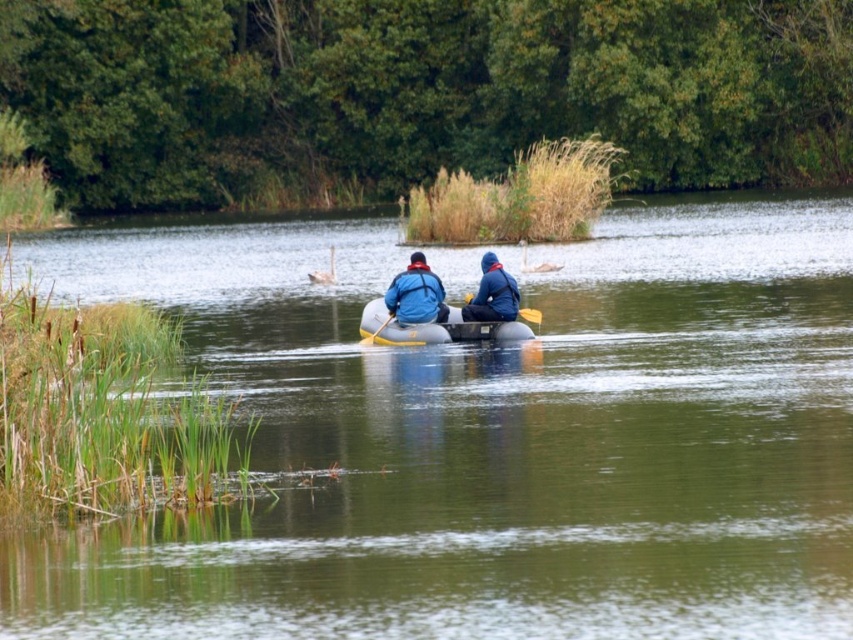
Based on the photo, does green rubber raft at center have a greater width compared to blue matte jacket at center?

Yes.

Measure the distance between green rubber raft at center and camera.

green rubber raft at center and camera are 8.73 meters apart from each other.

Is point (782, 358) positioned before point (495, 307)?

That is True.

Image resolution: width=853 pixels, height=640 pixels. Find the location of `green rubber raft at center`. green rubber raft at center is located at coordinates pyautogui.click(x=491, y=440).

Between blue fabric jacket at center and yellow rubber paddle at center, which one is positioned higher?

blue fabric jacket at center is higher up.

Which is behind, point (407, 292) or point (527, 321)?

The point (527, 321) is more distant.

Is point (444, 314) positioned in front of point (468, 292)?

No, (444, 314) is further to viewer.

I want to click on blue fabric jacket at center, so click(416, 294).

Consider the image. Is blue matte jacket at center bigger than yellow wood paddle at center?

Yes, blue matte jacket at center is bigger than yellow wood paddle at center.

Can you confirm if blue matte jacket at center is positioned to the right of yellow wood paddle at center?

Correct, you'll find blue matte jacket at center to the right of yellow wood paddle at center.

Who is more distant from viewer, (x=465, y=316) or (x=387, y=316)?

Positioned behind is point (x=387, y=316).

Find the location of a particular element. The image size is (853, 640). blue matte jacket at center is located at coordinates (492, 292).